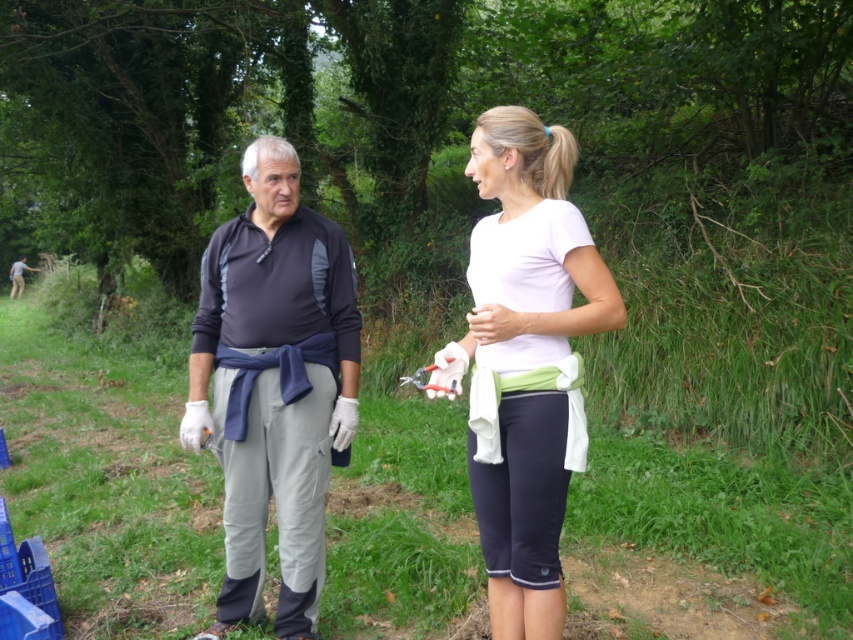
You are a photographer positioned in front of the two people in the image. You want to take a photo that clearly shows both the dark gray fleece at center and the camouflage fabric shirt at left. Which object should you focus on first to ensure both are in focus?

You should focus on the camouflage fabric shirt at left first because it is farther away from the viewer than the dark gray fleece at center. By focusing on the farther object, both will be in focus if they are within the depth of field.

You are standing in the grassy area and want to walk from the point marked as point (316, 220) to the point marked as point (479, 524). Which direction should you head to get there?

Since point (316, 220) is closer to you than point (479, 524), you should walk away from your current position towards the point (479, 524).